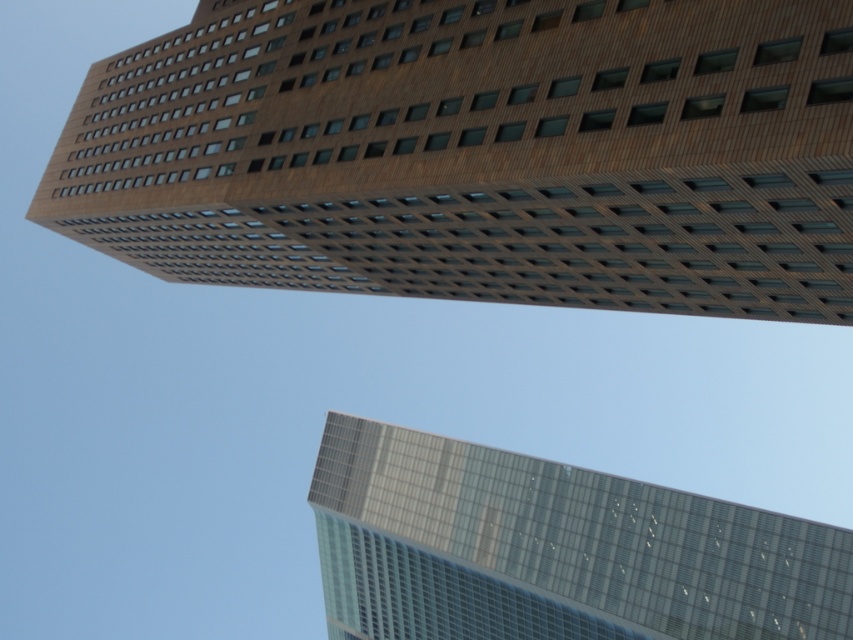
Question: Which point is closer to the camera taking this photo?

Choices:
 (A) (376, 259)
 (B) (648, 547)

Answer: (A)

Question: Can you confirm if brown brick building at upper center is thinner than transparent glass skyscraper at lower right?

Choices:
 (A) yes
 (B) no

Answer: (B)

Question: Considering the relative positions of brown brick building at upper center and transparent glass skyscraper at lower right in the image provided, where is brown brick building at upper center located with respect to transparent glass skyscraper at lower right?

Choices:
 (A) above
 (B) below

Answer: (A)

Question: From the image, what is the correct spatial relationship of brown brick building at upper center in relation to transparent glass skyscraper at lower right?

Choices:
 (A) above
 (B) below

Answer: (A)